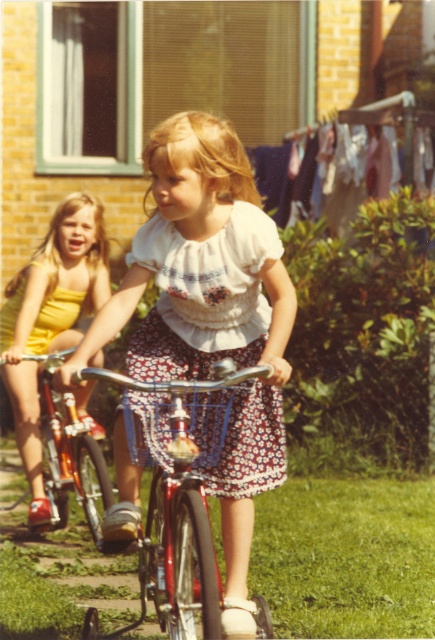
Question: Considering the real-world distances, which object is closest to the floral cotton dress at center?

Choices:
 (A) shiny metallic bicycle at center
 (B) shiny orange bicycle at left
 (C) matte white blouse at center

Answer: (C)

Question: Can you confirm if floral cotton dress at center is positioned above shiny metallic bicycle at center?

Choices:
 (A) yes
 (B) no

Answer: (A)

Question: Does matte white blouse at center lie behind cloth fabric clothesline at upper center?

Choices:
 (A) yes
 (B) no

Answer: (B)

Question: Which object is the farthest from the cloth fabric clothesline at upper center?

Choices:
 (A) shiny metallic bicycle at center
 (B) shiny orange bicycle at left

Answer: (A)

Question: Which object is the closest to the shiny metallic bicycle at center?

Choices:
 (A) floral cotton dress at center
 (B) matte white blouse at center

Answer: (B)

Question: Is cloth fabric clothesline at upper center smaller than shiny orange bicycle at left?

Choices:
 (A) yes
 (B) no

Answer: (B)